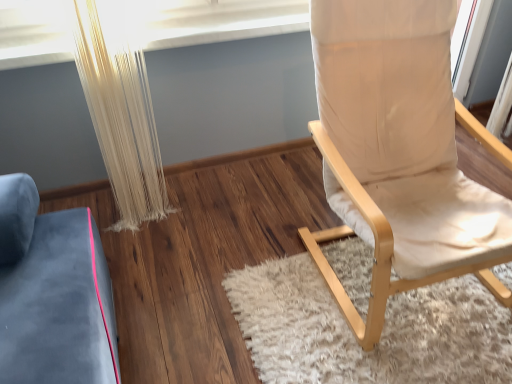
Locate an element on the screen. This screenshot has height=384, width=512. vacant area that is situated to the right of white textured curtain at left is located at coordinates (202, 213).